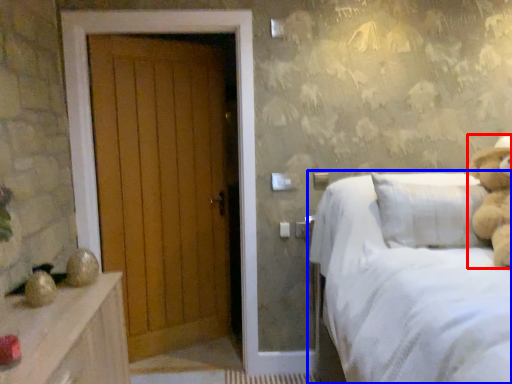
Question: Which of the following is the closest to the observer, teddy bear (highlighted by a red box) or bed (highlighted by a blue box)?

Choices:
 (A) teddy bear
 (B) bed

Answer: (B)